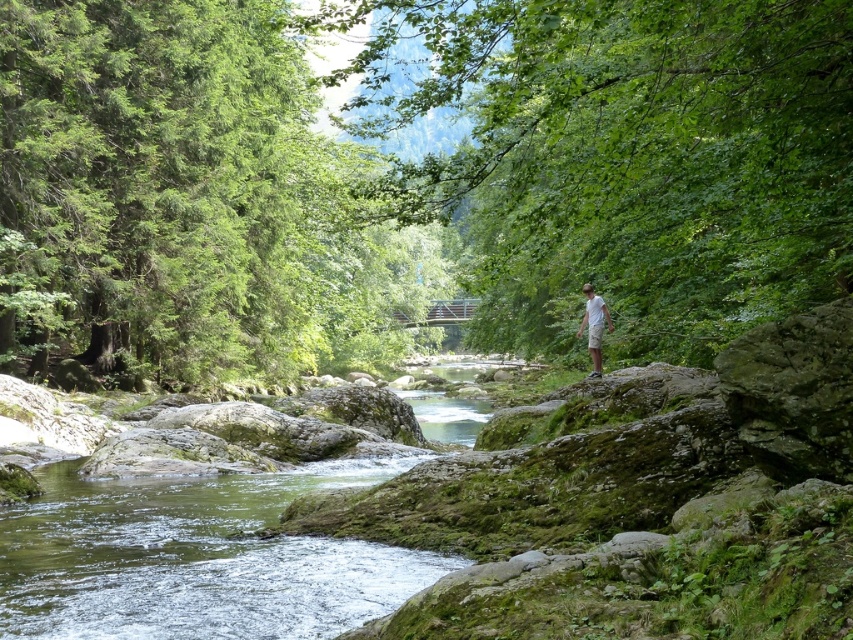
Question: Which of these objects is positioned farthest from the green mossy water at center?

Choices:
 (A) green leafy tree at upper left
 (B) white cotton shirt at center
 (C) green leafy tree at center

Answer: (C)

Question: Which point appears closest to the camera in this image?

Choices:
 (A) (445, 74)
 (B) (589, 300)
 (C) (115, 10)
 (D) (65, 465)

Answer: (A)

Question: Can you confirm if green leafy tree at center is wider than green leafy tree at upper left?

Choices:
 (A) no
 (B) yes

Answer: (B)

Question: Can you confirm if green leafy tree at center is thinner than green leafy tree at upper left?

Choices:
 (A) yes
 (B) no

Answer: (B)

Question: Which point is farther to the camera?

Choices:
 (A) green leafy tree at upper left
 (B) green leafy tree at center

Answer: (A)

Question: In this image, where is green leafy tree at upper left located relative to white cotton shirt at center?

Choices:
 (A) above
 (B) below

Answer: (A)